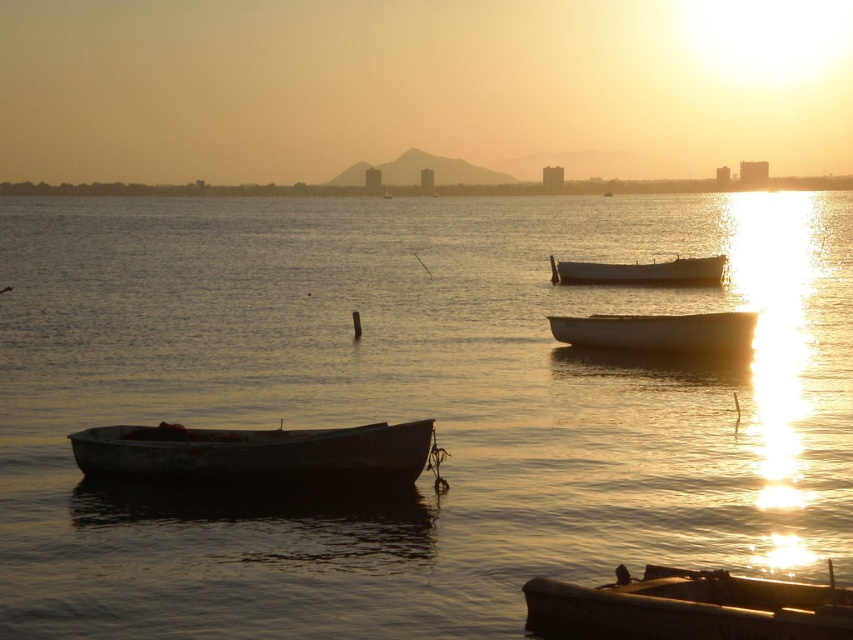
Is smooth water at center taller than rusty metal boat at left?

Yes.

The width and height of the screenshot is (853, 640). Identify the location of smooth water at center. (410, 404).

Which is behind, point (254, 608) or point (622, 596)?

The point (254, 608) is more distant.

Does smooth water at center appear on the left side of rusty metal boat at lower right?

Indeed, smooth water at center is positioned on the left side of rusty metal boat at lower right.

Which is in front, point (457, 552) or point (579, 628)?

Positioned in front is point (579, 628).

The image size is (853, 640). Find the location of `smooth water at center`. smooth water at center is located at coordinates (410, 404).

Between point (126, 449) and point (653, 284), which one is positioned behind?

Point (653, 284)

Is point (218, 456) less distant than point (712, 259)?

That is True.

The width and height of the screenshot is (853, 640). Find the location of `rusty metal boat at left`. rusty metal boat at left is located at coordinates (258, 456).